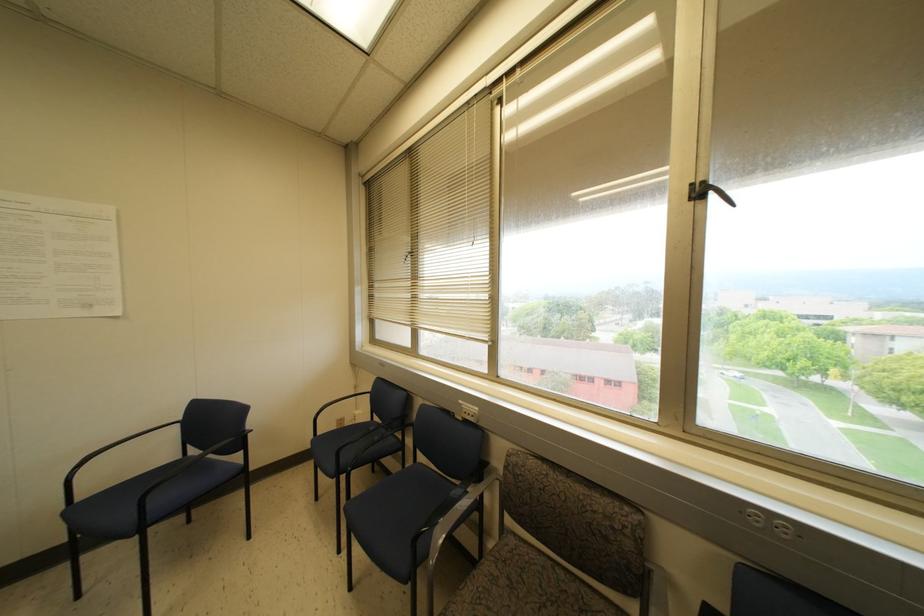
Locate an element on the screen. black window handle is located at coordinates (721, 193).